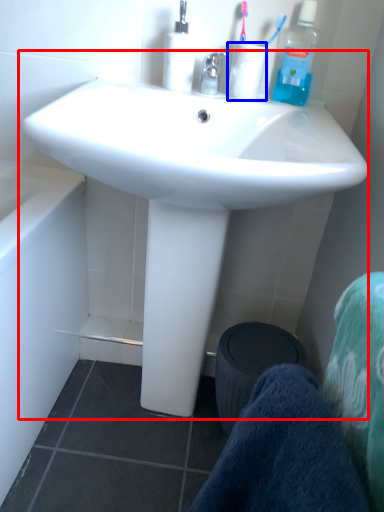
Question: Which of the following is the farthest to the observer, sink (highlighted by a red box) or coffee cup (highlighted by a blue box)?

Choices:
 (A) sink
 (B) coffee cup

Answer: (B)